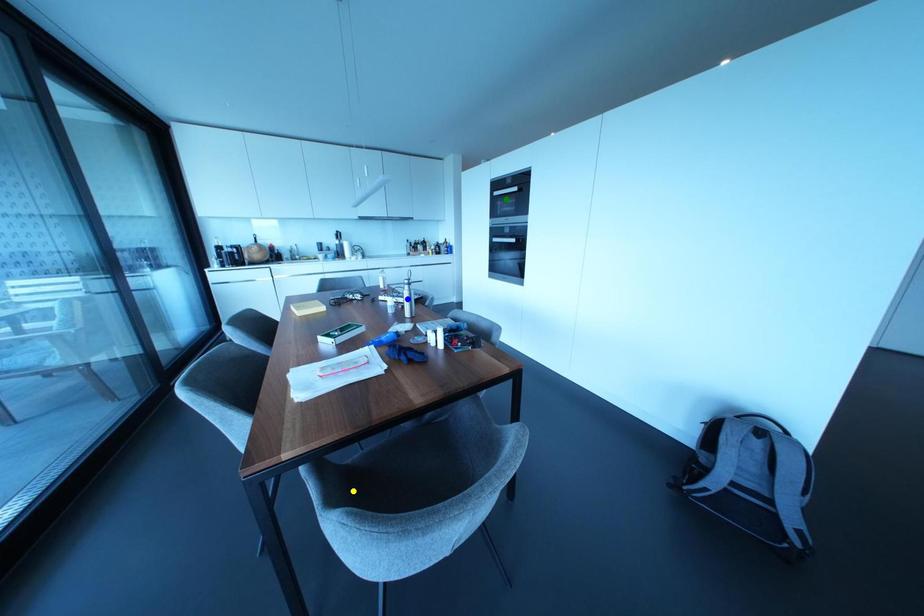
Order these from nearest to farthest:
- green point
- blue point
- yellow point

yellow point → blue point → green point